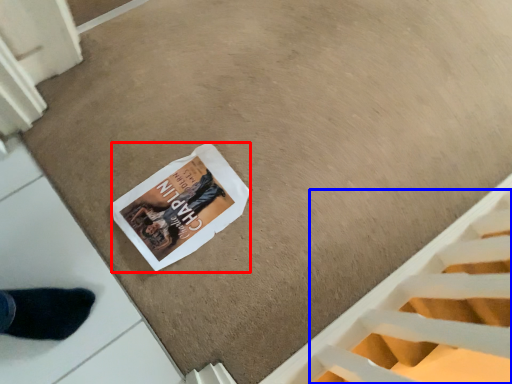
Question: Which object is closer to the camera taking this photo, magazine (highlighted by a red box) or stairwell (highlighted by a blue box)?

Choices:
 (A) magazine
 (B) stairwell

Answer: (B)